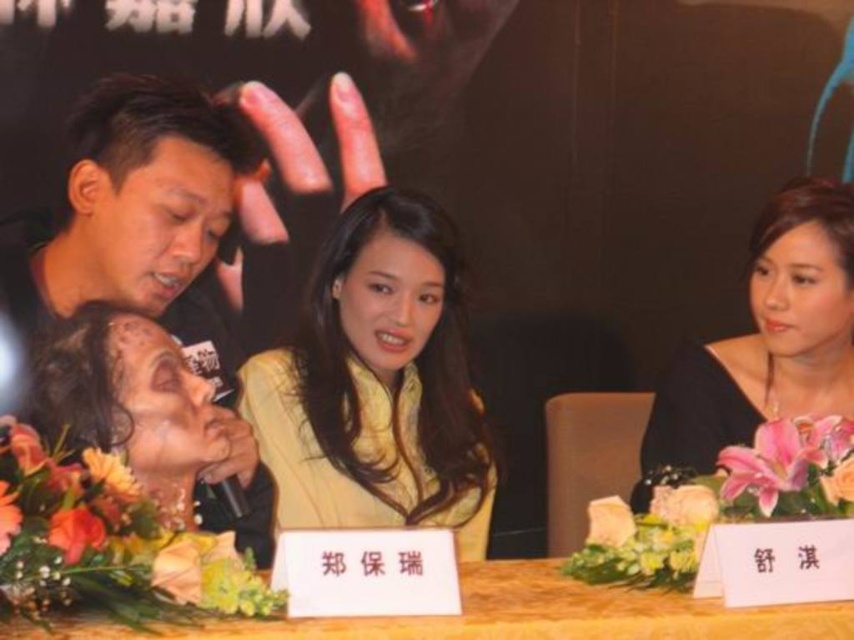
Question: Can you confirm if yellow matte jacket at center is positioned above wooden table at center?

Choices:
 (A) no
 (B) yes

Answer: (B)

Question: Is yellow matte jacket at center closer to the viewer compared to black silk dress at right?

Choices:
 (A) yes
 (B) no

Answer: (A)

Question: Considering the real-world distances, which object is closest to the wooden table at center?

Choices:
 (A) black silk dress at right
 (B) yellow matte jacket at center

Answer: (B)

Question: Which is farther from the black silk dress at right?

Choices:
 (A) yellow matte jacket at center
 (B) wooden table at center

Answer: (B)

Question: Which point appears farthest from the camera in this image?

Choices:
 (A) (336, 301)
 (B) (794, 209)
 (C) (564, 620)

Answer: (A)

Question: Does black silk dress at right appear on the right side of wooden table at center?

Choices:
 (A) yes
 (B) no

Answer: (A)